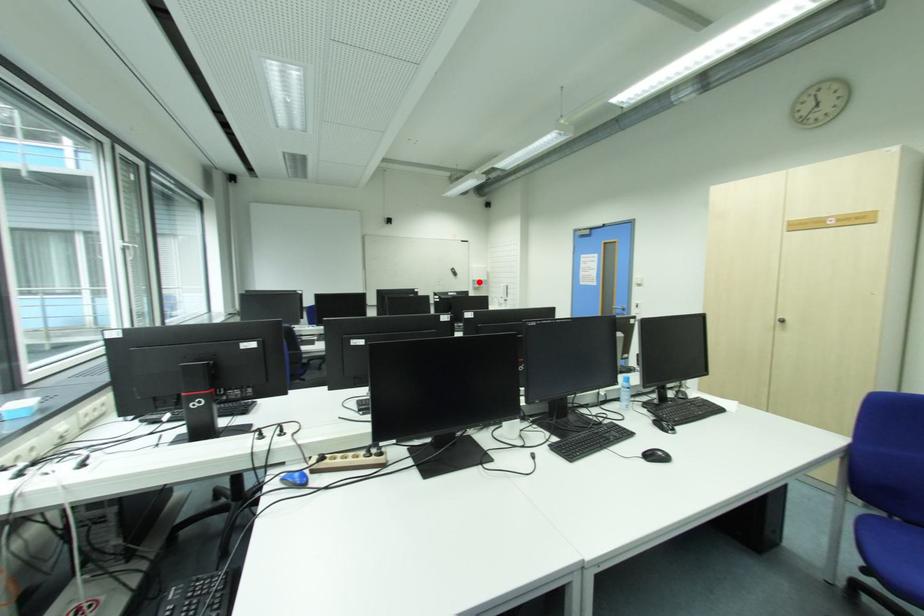
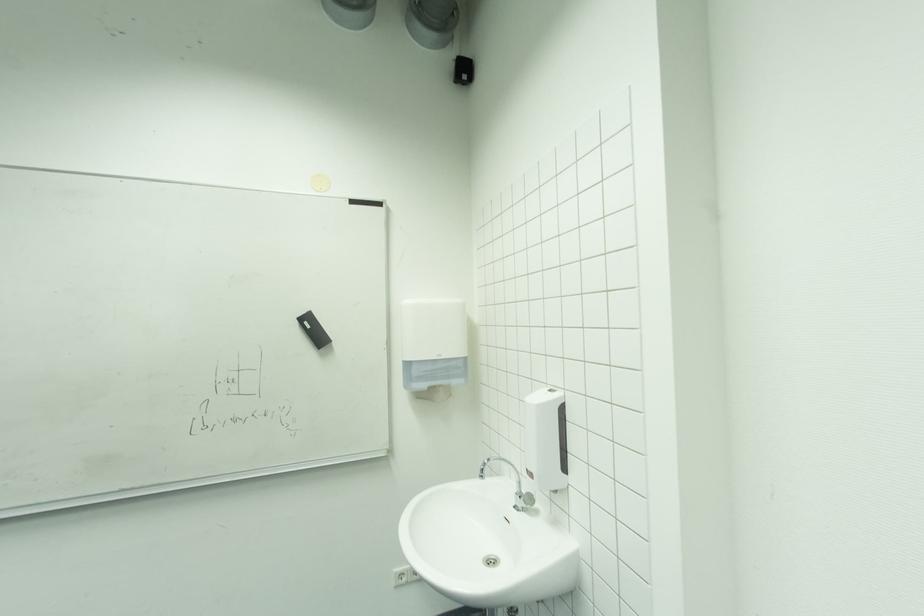
Locate, in the second image, the point that corresponds to the highlighted location in the first image.

(412, 365)